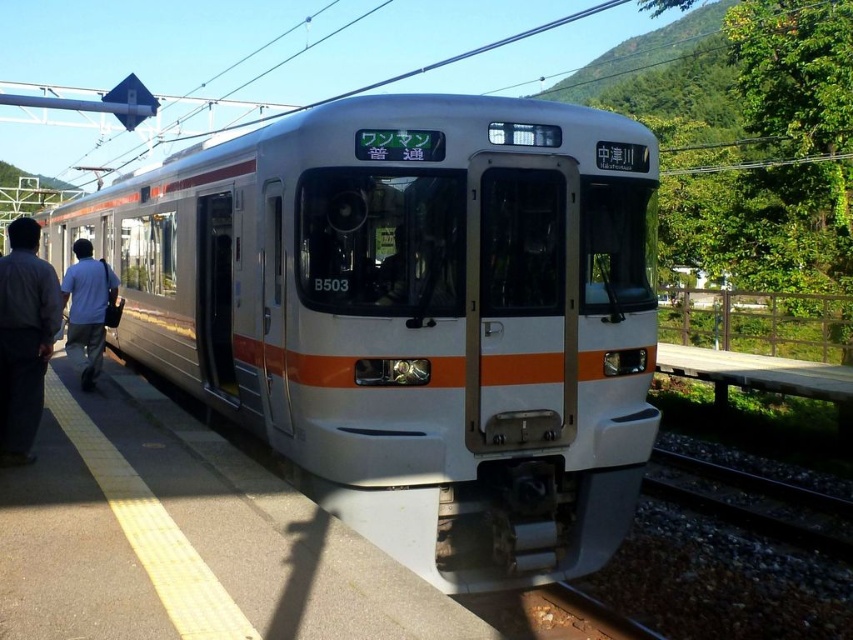
You are standing on the platform and want to board the white glossy train at center. Based on its position, which direction should you walk to reach it?

The white glossy train at center is located at point (410,316), so you should walk towards the center of the platform to reach it.

You are a passenger waiting on the platform. You see a person wearing dark gray fabric pants at left and light blue shirt at left. Which clothing item is closer to you?

The dark gray fabric pants at left is in front of the light blue shirt at left, so the dark gray fabric pants at left is closer to you.

You are a passenger waiting on the platform. You notice the white glossy train at center and the dark gray fabric pants at left. Which object is taller?

The white glossy train at center is taller than the dark gray fabric pants at left.